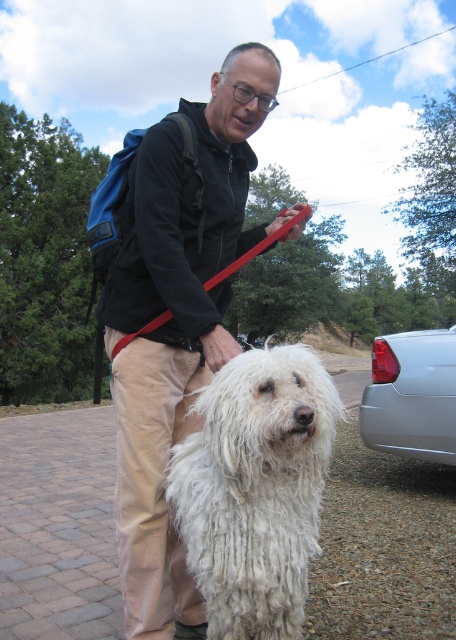
You are a photographer trying to capture a photo of the black matte jacket at center and the red rubber leash at center. Which object should you focus on first if you want to include both in your frame?

The black matte jacket at center is positioned on the left side of red rubber leash at center, so you should focus on the black matte jacket at center first to ensure both are in frame.

You are a photographer planning to take a picture of the white fluffy dog at center and the satin silver car at right. Based on their positions, which object will appear closer to the camera in the photo?

The white fluffy dog at center will appear closer to the camera in the photo because it is positioned in front of the satin silver car at right.